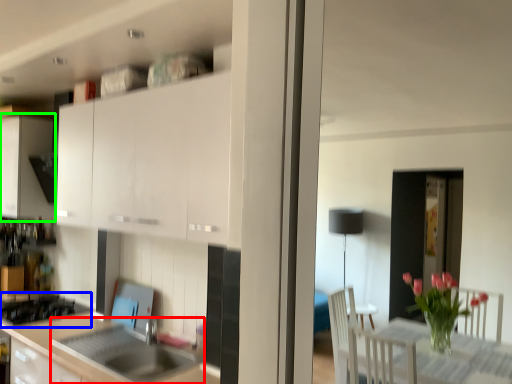
Question: Based on their relative distances, which object is farther from sink (highlighted by a red box)? Choose from gas stove (highlighted by a blue box) and cabinetry (highlighted by a green box).

Choices:
 (A) gas stove
 (B) cabinetry

Answer: (B)